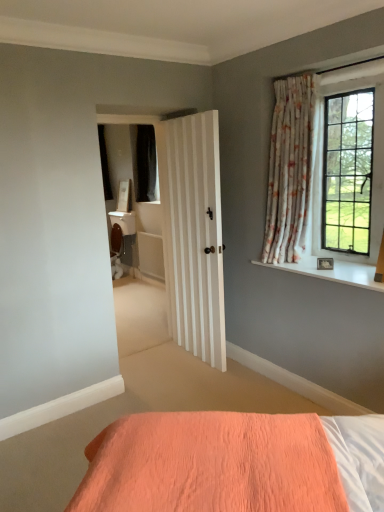
Question: From a real-world perspective, is clear glass window at upper right physically above floral fabric curtain at upper right?

Choices:
 (A) no
 (B) yes

Answer: (B)

Question: Is clear glass window at upper right in contact with floral fabric curtain at upper right?

Choices:
 (A) yes
 (B) no

Answer: (B)

Question: Is clear glass window at upper right positioned with its back to floral fabric curtain at upper right?

Choices:
 (A) no
 (B) yes

Answer: (A)

Question: Is clear glass window at upper right closer to camera compared to floral fabric curtain at upper right?

Choices:
 (A) no
 (B) yes

Answer: (B)

Question: From the image's perspective, is clear glass window at upper right beneath floral fabric curtain at upper right?

Choices:
 (A) no
 (B) yes

Answer: (A)

Question: Is white smooth window sill at upper right in front of or behind clear glass window at upper right in the image?

Choices:
 (A) behind
 (B) front

Answer: (B)

Question: Considering the positions of white smooth window sill at upper right and clear glass window at upper right in the image, is white smooth window sill at upper right wider or thinner than clear glass window at upper right?

Choices:
 (A) thin
 (B) wide

Answer: (B)

Question: Do you think white smooth window sill at upper right is within clear glass window at upper right, or outside of it?

Choices:
 (A) outside
 (B) inside

Answer: (A)

Question: Is white smooth window sill at upper right to the left or to the right of clear glass window at upper right in the image?

Choices:
 (A) left
 (B) right

Answer: (A)

Question: From the image's perspective, is floral fabric curtain at upper right above or below clear glass window at upper right?

Choices:
 (A) above
 (B) below

Answer: (B)

Question: From their relative heights in the image, would you say floral fabric curtain at upper right is taller or shorter than clear glass window at upper right?

Choices:
 (A) short
 (B) tall

Answer: (B)

Question: Does point (294, 197) appear closer or farther from the camera than point (326, 109)?

Choices:
 (A) closer
 (B) farther

Answer: (B)

Question: Looking at their shapes, would you say floral fabric curtain at upper right is wider or thinner than clear glass window at upper right?

Choices:
 (A) wide
 (B) thin

Answer: (A)

Question: Considering the positions of floral fabric curtain at upper right and white smooth window sill at upper right in the image, is floral fabric curtain at upper right taller or shorter than white smooth window sill at upper right?

Choices:
 (A) short
 (B) tall

Answer: (B)

Question: Is floral fabric curtain at upper right spatially inside white smooth window sill at upper right, or outside of it?

Choices:
 (A) outside
 (B) inside

Answer: (A)